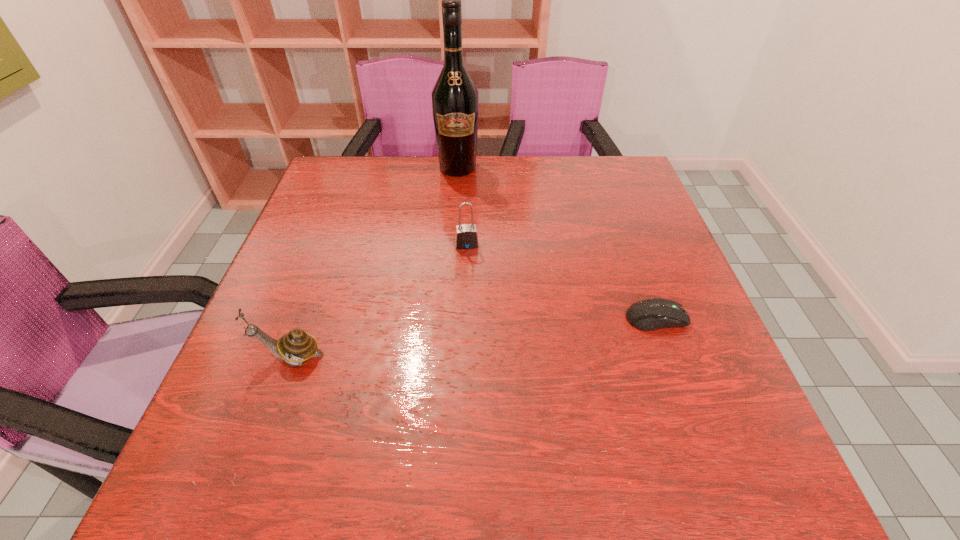
What are the coordinates of `free space at the far left corner` in the screenshot? It's located at (350, 158).

You are a GUI agent. You are given a task and a screenshot of the screen. Output one action in this format:
    pyautogui.click(x=<x>, y=<y>)
    Task: Click on the vacant space at the near left corner
    The image size is (960, 540).
    Given the screenshot: What is the action you would take?
    pyautogui.click(x=298, y=397)

Find the location of a particular element. This screenshot has height=540, width=960. vacant area at the far right corner of the desktop is located at coordinates (609, 178).

Where is `vacant space at the near right corner of the desktop`? This screenshot has width=960, height=540. vacant space at the near right corner of the desktop is located at coordinates 699,387.

The height and width of the screenshot is (540, 960). I want to click on vacant space in between the nearest object and the third nearest object, so [x=378, y=301].

Find the location of a particular element. This screenshot has width=960, height=540. vacant region between the wine bottle and the rightmost object is located at coordinates (557, 243).

This screenshot has height=540, width=960. I want to click on empty location between the wine bottle and the shortest object, so click(557, 243).

Identify the location of free point between the snail and the rightmost object. (473, 338).

Locate an element on the screen. empty space between the farthest object and the third nearest object is located at coordinates (463, 206).

Image resolution: width=960 pixels, height=540 pixels. Find the location of `vacant area that lies between the padlock and the wine bottle`. vacant area that lies between the padlock and the wine bottle is located at coordinates (x=463, y=206).